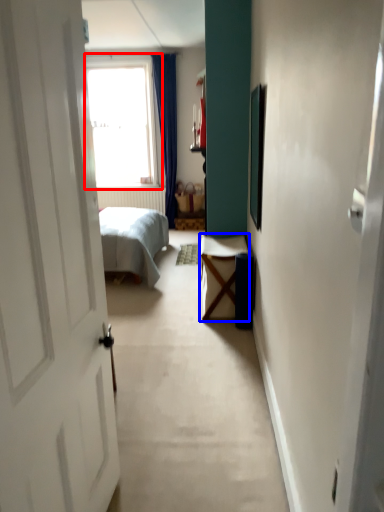
Question: Among these objects, which one is nearest to the camera, window (highlighted by a red box) or table (highlighted by a blue box)?

Choices:
 (A) window
 (B) table

Answer: (B)